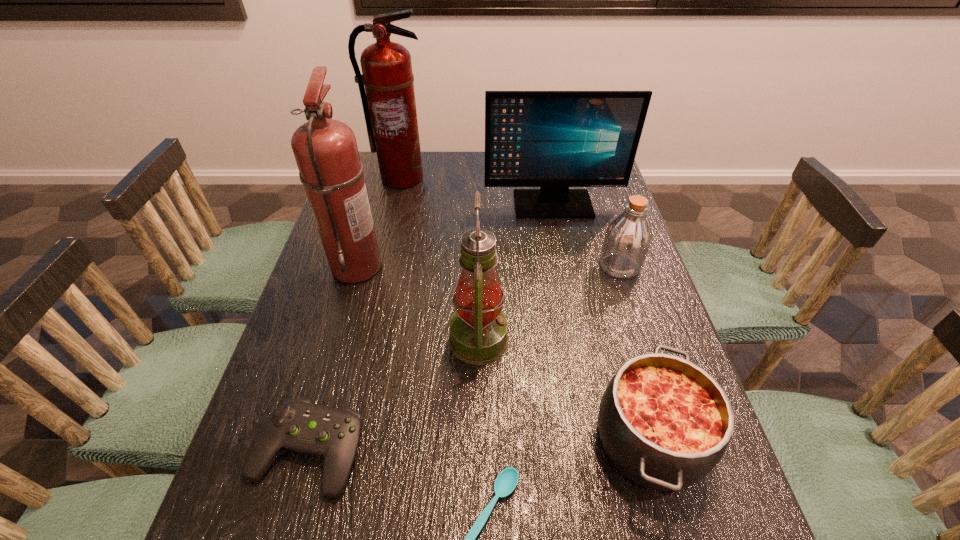
Find the location of a particular element. The image size is (960, 540). vacant space at the far edge of the desktop is located at coordinates (439, 182).

This screenshot has height=540, width=960. In order to click on free spot at the left edge of the desktop in this screenshot , I will do `click(320, 353)`.

The height and width of the screenshot is (540, 960). In the image, there is a desktop. In order to click on free space at the right edge in this screenshot , I will do `click(618, 319)`.

Locate an element on the screen. blank region between the monitor and the control is located at coordinates (431, 328).

Identify the location of vacant area between the monitor and the sixth tallest object. (601, 322).

Where is `free space between the control and the farther fire extinguisher`? free space between the control and the farther fire extinguisher is located at coordinates (355, 314).

Locate an element on the screen. Image resolution: width=960 pixels, height=540 pixels. free space between the casserole and the farthest object is located at coordinates (525, 308).

Identify the location of free space between the bottle and the second farthest object. This screenshot has width=960, height=540. (587, 235).

Choose which object is the seventh nearest neighbor to the farther fire extinguisher. Please provide its 2D coordinates. Your answer should be formatted as a tuple, i.e. [(x, y)], where the tuple contains the x and y coordinates of a point satisfying the conditions above.

[(505, 483)]

Where is `object that is the sixth closest to the shortest object`? This screenshot has height=540, width=960. object that is the sixth closest to the shortest object is located at coordinates (554, 140).